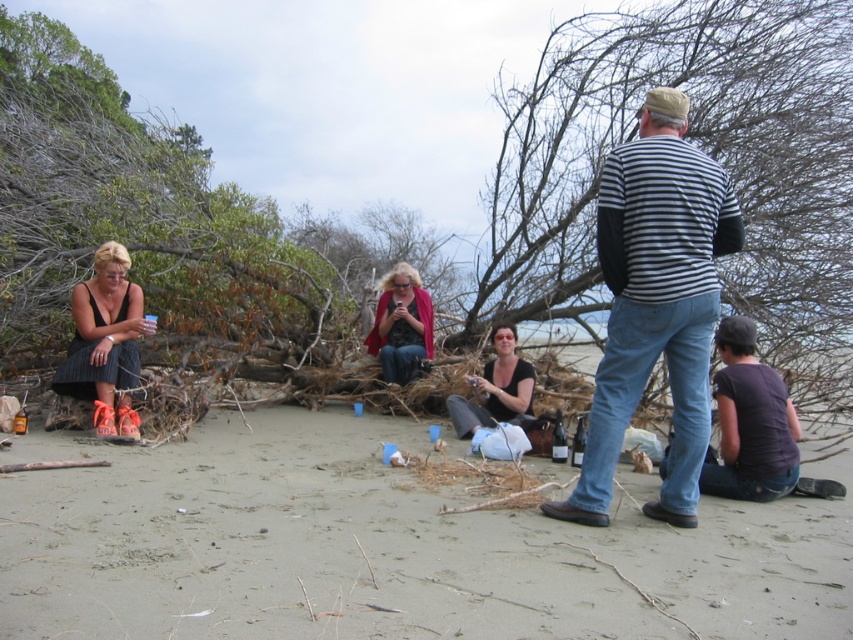
You are a photographer trying to capture a clear shot of the smooth sand at center and the matte pink coat at center. Since you want both subjects to be visible, which object should you focus on first to ensure depth of field?

The smooth sand at center is not as tall as matte pink coat at center, so you should focus on the matte pink coat at center first to ensure both are in focus.

Looking at this image, you are a photographer trying to capture a candid shot of the matte black shirt at center without including the striped cotton shirt at center in the frame. Is this possible given their current positions?

The striped cotton shirt at center is positioned over the matte black shirt at center, so it would block the view. Therefore, it is not possible to capture the matte black shirt at center without including the striped cotton shirt at center in the frame.